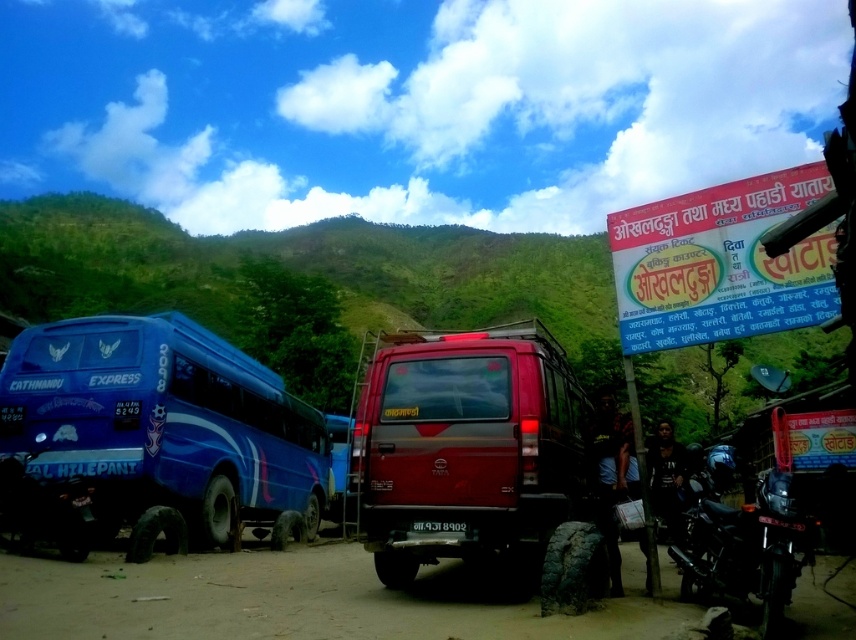
Is the position of blue glossy bus at left more distant than that of black matte motorcycle at lower right?

Yes, blue glossy bus at left is behind black matte motorcycle at lower right.

Between blue glossy bus at left and black matte motorcycle at lower right, which one has less height?

black matte motorcycle at lower right is shorter.

This screenshot has height=640, width=856. What do you see at coordinates (164, 428) in the screenshot?
I see `blue glossy bus at left` at bounding box center [164, 428].

Locate an element on the screen. The width and height of the screenshot is (856, 640). blue glossy bus at left is located at coordinates pos(164,428).

Can you confirm if black matte motorcycle at lower right is positioned above black plastic license plate at center?

No, black matte motorcycle at lower right is not above black plastic license plate at center.

Who is more distant from viewer, (789,524) or (437,522)?

Point (437,522)

Where is `black matte motorcycle at lower right`? black matte motorcycle at lower right is located at coordinates (749, 548).

Does blue glossy bus at left lie behind dirt field at lower center?

Yes.

Is blue glossy bus at left shorter than dirt field at lower center?

In fact, blue glossy bus at left may be taller than dirt field at lower center.

Where is `blue glossy bus at left`? blue glossy bus at left is located at coordinates (164, 428).